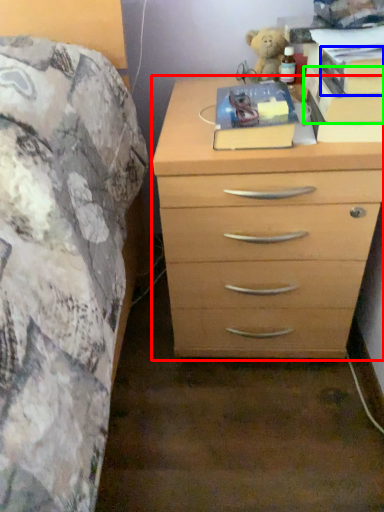
Question: Estimate the real-world distances between objects in this image. Which object is farther from chest of drawers (highlighted by a red box), paperback book (highlighted by a blue box) or paperback book (highlighted by a green box)?

Choices:
 (A) paperback book
 (B) paperback book

Answer: (A)